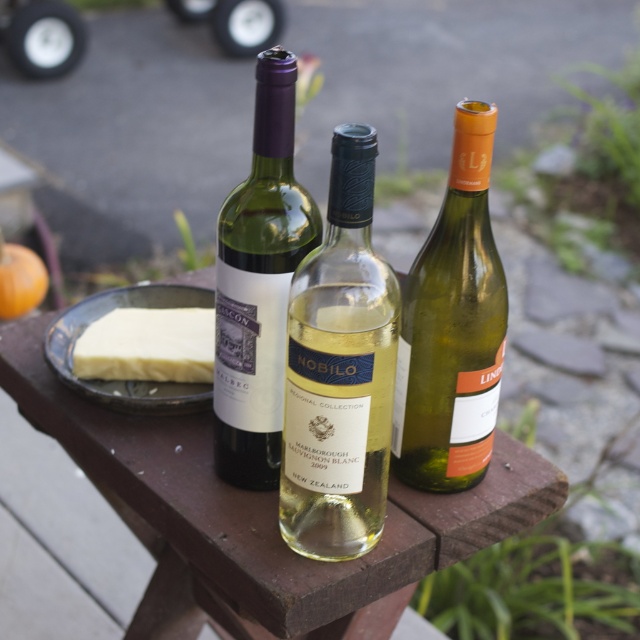
Question: Does translucent glass bottle at center have a smaller size compared to matte glass wine bottle at center?

Choices:
 (A) yes
 (B) no

Answer: (A)

Question: Does wooden table at center appear on the right side of white matte cheese at center?

Choices:
 (A) yes
 (B) no

Answer: (A)

Question: Among these points, which one is farthest from the camera?

Choices:
 (A) (461, 392)
 (B) (189, 484)

Answer: (B)

Question: Which of the following is the closest to the observer?

Choices:
 (A) white matte cheese at center
 (B) white creamy cheese at left
 (C) wooden table at center
 (D) green glass bottle at center

Answer: (D)

Question: Does green glass bottle at center come behind matte glass wine bottle at center?

Choices:
 (A) no
 (B) yes

Answer: (B)

Question: Which of the following is the farthest from the observer?

Choices:
 (A) white matte cheese at center
 (B) translucent glass bottle at center
 (C) white creamy cheese at left
 (D) wooden table at center

Answer: (C)